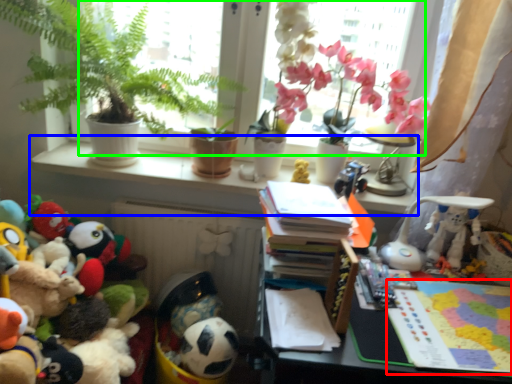
Question: Considering the real-world distances, which object is closest to book (highlighted by a red box)? window sill (highlighted by a blue box) or window screen (highlighted by a green box).

Choices:
 (A) window sill
 (B) window screen

Answer: (A)